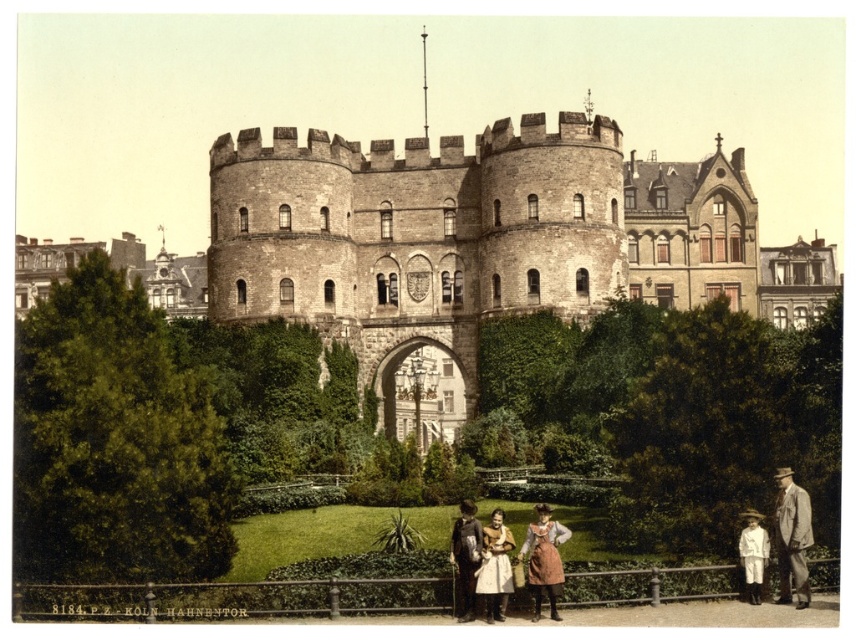
You are a photographer planning to take a group photo of the people in the scene. You need to arrange them so that both the matte brown dress at center and the brown leather jacket at center are visible. Given their heights, which one should be placed in front to ensure both are visible?

The matte brown dress at center is not as tall as the brown leather jacket at center, so the shorter matte brown dress at center should be placed in front to ensure both are visible.

You are a photographer who wants to capture a photo of the matte brown dress at center and the brown leather jacket at center. Which one is located to the right of the other?

The matte brown dress at center is positioned on the right side of brown leather jacket at center.